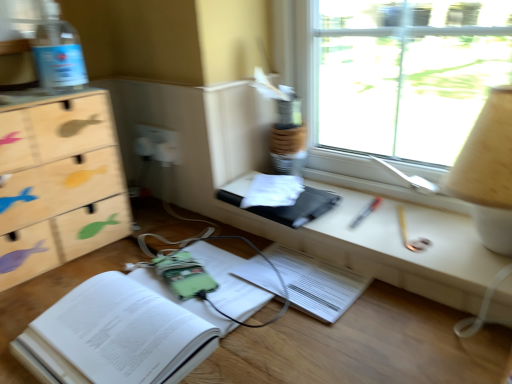
Image resolution: width=512 pixels, height=384 pixels. I want to click on wooden fish-patterned chest of drawers at left, so pyautogui.click(x=59, y=184).

What do you see at coordinates (488, 171) in the screenshot? The width and height of the screenshot is (512, 384). I see `beige fabric lampshade at upper right` at bounding box center [488, 171].

Image resolution: width=512 pixels, height=384 pixels. Describe the element at coordinates (58, 51) in the screenshot. I see `transparent plastic bottle at upper left` at that location.

Identify the location of white plastic electric outlet at center. The width and height of the screenshot is (512, 384). (158, 144).

Is transparent plastic bottle at upper left positioned with its back to wooden fish-patterned chest of drawers at left?

transparent plastic bottle at upper left is not turned away from wooden fish-patterned chest of drawers at left.

Is transparent plastic bottle at upper left positioned far away from wooden fish-patterned chest of drawers at left?

No, transparent plastic bottle at upper left is not far from wooden fish-patterned chest of drawers at left.

From the picture: Measure the distance from transparent plastic bottle at upper left to wooden fish-patterned chest of drawers at left.

6.95 inches.

You are a GUI agent. You are given a task and a screenshot of the screen. Output one action in this format:
    pyautogui.click(x=<x>, y=<y>)
    Task: Click on the bottle behind the wooden fish-patterned chest of drawers at left
    Image resolution: width=512 pixels, height=384 pixels.
    Given the screenshot: What is the action you would take?
    pyautogui.click(x=58, y=51)

Where is `computer desk that is below the transparent plastic bottle at upper left (from the image's perspective)`? Image resolution: width=512 pixels, height=384 pixels. computer desk that is below the transparent plastic bottle at upper left (from the image's perspective) is located at coordinates (393, 247).

In the scene shown: Considering the sizes of objects matte black tablet at center and transparent plastic bottle at upper left in the image provided, who is thinner, matte black tablet at center or transparent plastic bottle at upper left?

transparent plastic bottle at upper left is thinner.

Between point (244, 175) and point (46, 2), which one is positioned behind?

The point (244, 175) is more distant.

How many degrees apart are the facing directions of wooden fish-patterned chest of drawers at left and transparent plastic bottle at upper left?

wooden fish-patterned chest of drawers at left and transparent plastic bottle at upper left are facing 0.00131 degrees away from each other.

Is point (47, 171) farther from camera compared to point (45, 71)?

Yes, it is behind point (45, 71).

Which is more to the left, wooden fish-patterned chest of drawers at left or transparent plastic bottle at upper left?

wooden fish-patterned chest of drawers at left is more to the left.

Which is farther, (44,191) or (208,306)?

Positioned behind is point (44,191).

Which of these two, wooden fish-patterned chest of drawers at left or green fabric book at lower left, arranged as the 2th paperback book when viewed from the top, is smaller?

With smaller size is green fabric book at lower left, arranged as the 2th paperback book when viewed from the top.

From the picture: Can you see wooden fish-patterned chest of drawers at left touching green fabric book at lower left, arranged as the 2th paperback book when viewed from the top?

No, wooden fish-patterned chest of drawers at left is not making contact with green fabric book at lower left, arranged as the 2th paperback book when viewed from the top.

Would you say wooden fish-patterned chest of drawers at left is to the left or to the right of green fabric book at lower left, positioned as the 1th paperback book in bottom-to-top order, in the picture?

wooden fish-patterned chest of drawers at left is positioned on green fabric book at lower left, positioned as the 1th paperback book in bottom-to-top order,'s left side.

Where is `chest of drawers to the left of transparent glass window at upper right`? Image resolution: width=512 pixels, height=384 pixels. chest of drawers to the left of transparent glass window at upper right is located at coordinates (59, 184).

How far apart are wooden fish-patterned chest of drawers at left and transparent glass window at upper right?

wooden fish-patterned chest of drawers at left is 21.01 inches away from transparent glass window at upper right.

Is wooden fish-patterned chest of drawers at left not close to transparent glass window at upper right?

wooden fish-patterned chest of drawers at left is actually quite close to transparent glass window at upper right.

Who is more distant, wooden fish-patterned chest of drawers at left or transparent glass window at upper right?

Positioned behind is transparent glass window at upper right.

Could you tell me if matte black tablet at center is facing white plastic electric outlet at center?

No, matte black tablet at center does not turn towards white plastic electric outlet at center.

Which of these two, matte black tablet at center or white plastic electric outlet at center, is bigger?

With larger size is matte black tablet at center.

From a real-world perspective, is green fabric book at lower left, arranged as the 2th paperback book when viewed from the top, positioned over black matte book at center, positioned as the 1th paperback book in top-to-bottom order, based on gravity?

No.

Is green fabric book at lower left, arranged as the 2th paperback book when viewed from the top, bigger than black matte book at center, positioned as the 1th paperback book in top-to-bottom order?

Yes, green fabric book at lower left, arranged as the 2th paperback book when viewed from the top, is bigger than black matte book at center, positioned as the 1th paperback book in top-to-bottom order.

Is green fabric book at lower left, arranged as the 2th paperback book when viewed from the top, further to camera compared to black matte book at center, marked as the 2th paperback book in a bottom-to-top arrangement?

No, the depth of green fabric book at lower left, arranged as the 2th paperback book when viewed from the top, is less than that of black matte book at center, marked as the 2th paperback book in a bottom-to-top arrangement.

Considering the sizes of objects green fabric book at lower left, arranged as the 2th paperback book when viewed from the top, and black matte book at center, marked as the 2th paperback book in a bottom-to-top arrangement, in the image provided, who is shorter, green fabric book at lower left, arranged as the 2th paperback book when viewed from the top, or black matte book at center, marked as the 2th paperback book in a bottom-to-top arrangement,?

black matte book at center, marked as the 2th paperback book in a bottom-to-top arrangement, is shorter.

This screenshot has height=384, width=512. I want to click on the chest of drawers located underneath the transparent plastic bottle at upper left (from a real-world perspective), so click(x=59, y=184).

In the image, there is a transparent plastic bottle at upper left. Identify the location of computer desk below it (from the image's perspective). (393, 247).

From the image, which object appears to be farther from wooden fish-patterned chest of drawers at left, black matte book at center, marked as the 2th paperback book in a bottom-to-top arrangement, or transparent plastic bottle at upper left?

black matte book at center, marked as the 2th paperback book in a bottom-to-top arrangement, is further to wooden fish-patterned chest of drawers at left.

Based on their spatial positions, is matte black tablet at center or wooden fish-patterned chest of drawers at left further from transparent plastic bottle at upper left?

matte black tablet at center lies further to transparent plastic bottle at upper left than the other object.

From the picture: Estimate the real-world distances between objects in this image. Which object is further from green fabric book at lower left, positioned as the 1th paperback book in bottom-to-top order, white plastic electric outlet at center or transparent glass window at upper right?

transparent glass window at upper right is further to green fabric book at lower left, positioned as the 1th paperback book in bottom-to-top order.

From the image, which object appears to be farther from white plastic electric outlet at center, black matte book at center, marked as the 2th paperback book in a bottom-to-top arrangement, or green fabric book at lower left, positioned as the 1th paperback book in bottom-to-top order?

Based on the image, green fabric book at lower left, positioned as the 1th paperback book in bottom-to-top order, appears to be further to white plastic electric outlet at center.

When comparing their distances from transparent glass window at upper right, does white plastic electric outlet at center or beige fabric lampshade at upper right seem closer?

beige fabric lampshade at upper right is closer to transparent glass window at upper right.

Looking at the image, which one is located closer to black matte book at center, positioned as the 1th paperback book in top-to-bottom order, matte black tablet at center or beige fabric lampshade at upper right?

matte black tablet at center.

From the image, which object appears to be nearer to beige fabric lampshade at upper right, black matte book at center, marked as the 2th paperback book in a bottom-to-top arrangement, or transparent glass window at upper right?

The object closer to beige fabric lampshade at upper right is transparent glass window at upper right.

Estimate the real-world distances between objects in this image. Which object is further from matte black tablet at center, green fabric book at lower left, positioned as the 1th paperback book in bottom-to-top order, or white plastic electric outlet at center?

The object further to matte black tablet at center is white plastic electric outlet at center.

Image resolution: width=512 pixels, height=384 pixels. I want to click on electric outlet situated between wooden fish-patterned chest of drawers at left and transparent glass window at upper right from left to right, so click(x=158, y=144).

Identify the location of paperback book between green fabric book at lower left, arranged as the 2th paperback book when viewed from the top, and transparent glass window at upper right. (300, 208).

You are a GUI agent. You are given a task and a screenshot of the screen. Output one action in this format:
    pyautogui.click(x=<x>, y=<y>)
    Task: Click on the window between white plastic electric outlet at center and beige fabric lampshade at upper right from left to right
    The image size is (512, 384).
    Given the screenshot: What is the action you would take?
    pyautogui.click(x=309, y=52)

The image size is (512, 384). I want to click on bottle situated between wooden fish-patterned chest of drawers at left and matte black tablet at center from left to right, so pos(58,51).